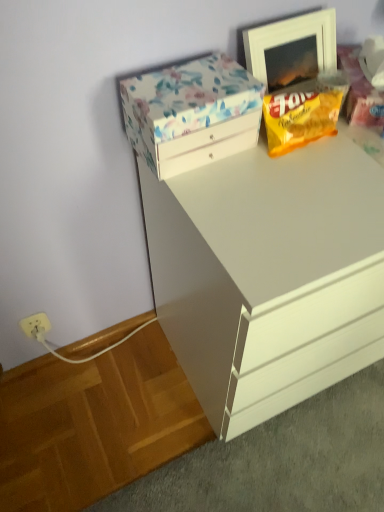
Find the location of a particular element. The image size is (384, 512). free region on the left part of white glossy chest of drawers at upper center is located at coordinates (111, 400).